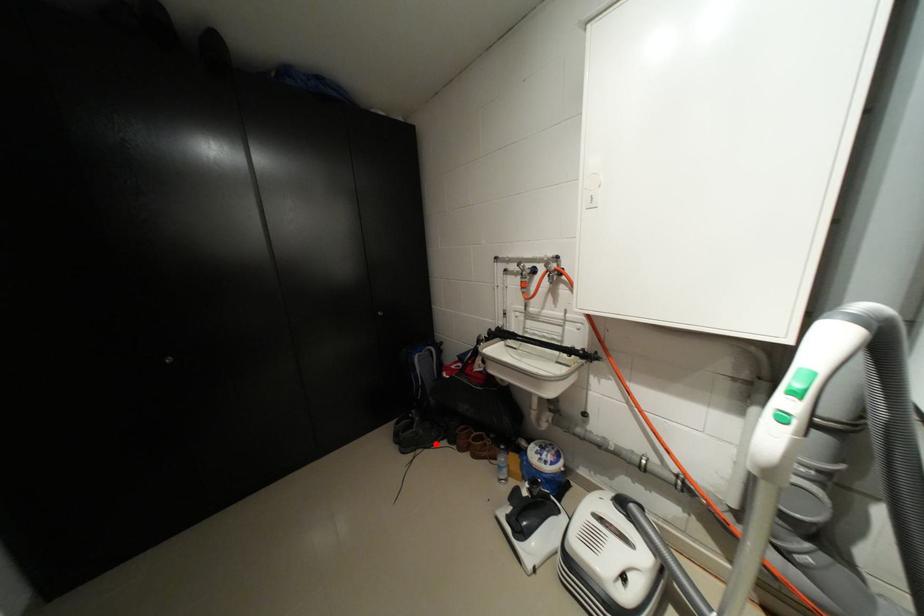
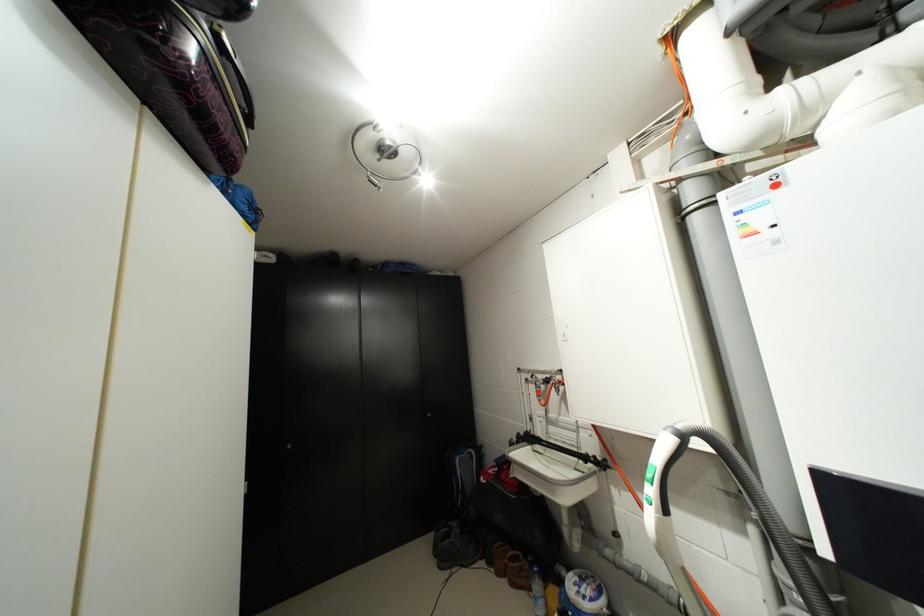
Locate, in the second image, the point that corresponds to the highlighted location in the first image.

(473, 562)